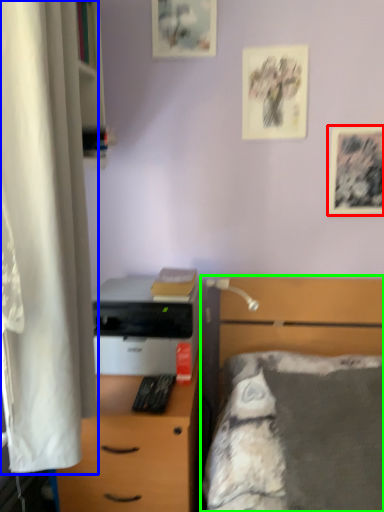
Question: Which object is the closest to the picture frame (highlighted by a red box)? Choose among these: curtain (highlighted by a blue box) or bed (highlighted by a green box).

Choices:
 (A) curtain
 (B) bed

Answer: (B)